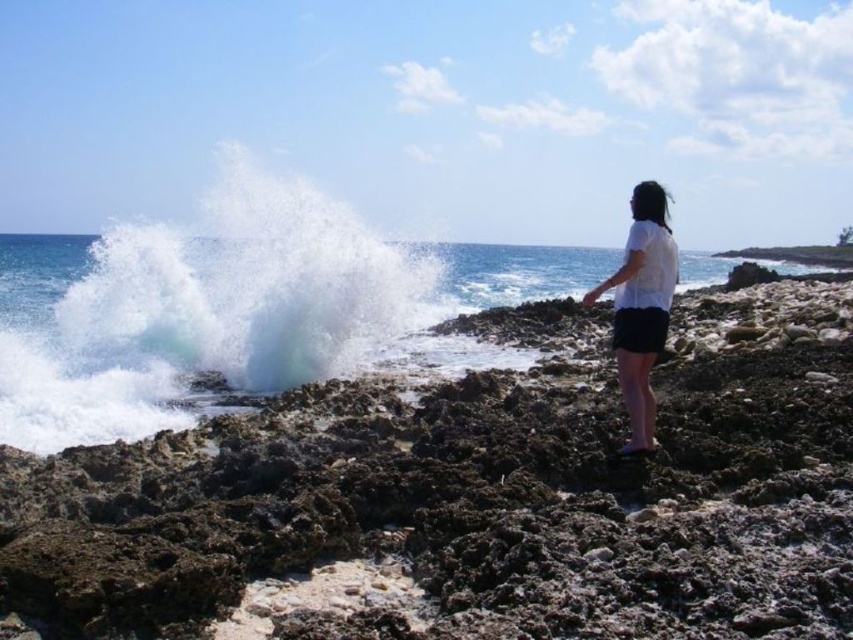
Question: Which object is the closest to the white matte shirt at right?

Choices:
 (A) rough textured rocks at center
 (B) white frothy wave at center

Answer: (A)

Question: Does white frothy wave at center appear on the right side of clear water at wave right?

Choices:
 (A) yes
 (B) no

Answer: (B)

Question: Can you confirm if clear water at wave right is positioned below white matte shirt at right?

Choices:
 (A) no
 (B) yes

Answer: (A)

Question: Estimate the real-world distances between objects in this image. Which object is closer to the white matte shirt at right?

Choices:
 (A) white frothy wave at center
 (B) rough textured rocks at center
 (C) clear water at wave right

Answer: (B)

Question: Can you confirm if rough textured rocks at center is wider than clear water at wave right?

Choices:
 (A) no
 (B) yes

Answer: (A)

Question: Which point appears farthest from the camera in this image?

Choices:
 (A) (140, 307)
 (B) (645, 189)
 (C) (659, 589)
 (D) (283, 358)

Answer: (A)